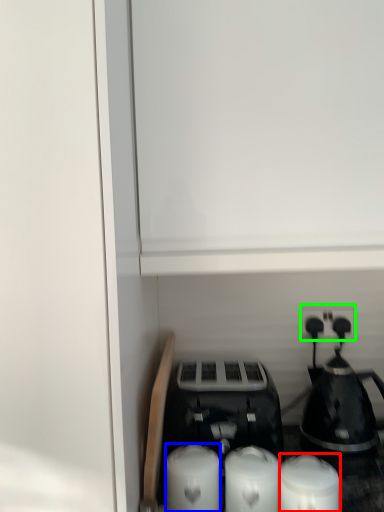
Question: Which object is positioned farthest from candle (highlighted by a red box)? Select from candle (highlighted by a blue box) and electric outlet (highlighted by a green box).

Choices:
 (A) candle
 (B) electric outlet

Answer: (B)